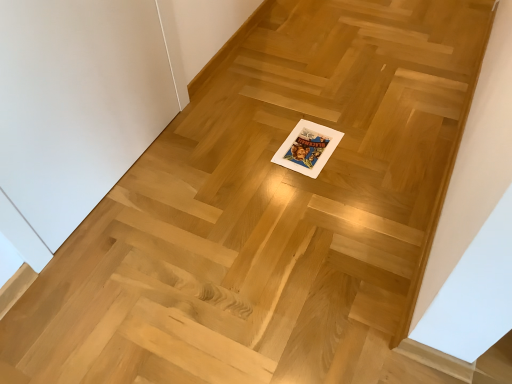
The width and height of the screenshot is (512, 384). Identify the location of free spot to the left of white paper at center. (255, 151).